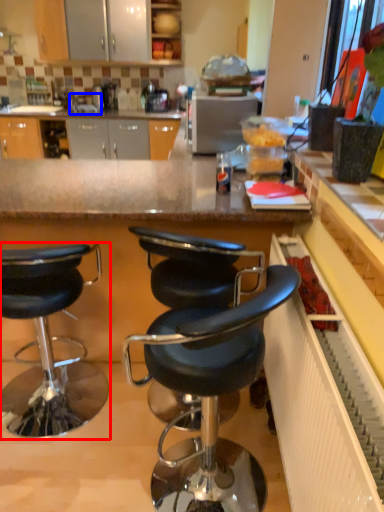
Question: Among these objects, which one is farthest to the camera, chair (highlighted by a red box) or sink (highlighted by a blue box)?

Choices:
 (A) chair
 (B) sink

Answer: (B)